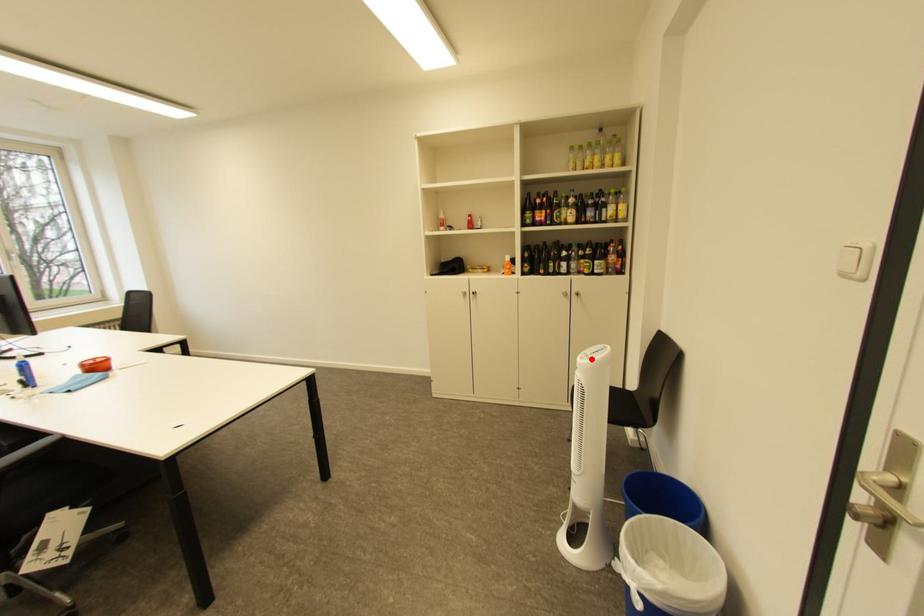
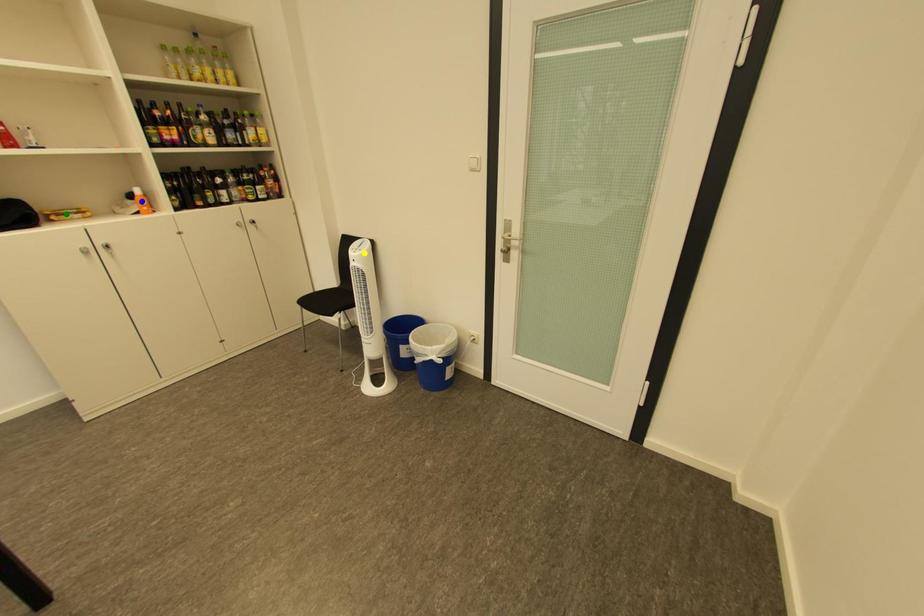
Question: I am providing you with two images of the same scene from different viewpoints. A red point is marked on the first image. You are given multiple points on the second image. Can you choose the point in image 2 that corresponds to the point in image 1?

Choices:
 (A) green point
 (B) blue point
 (C) yellow point

Answer: (C)